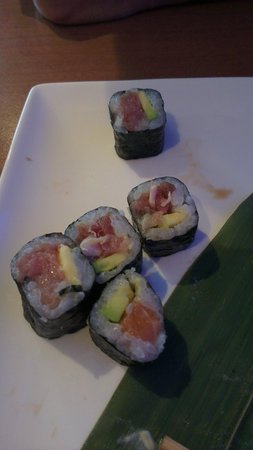
The height and width of the screenshot is (450, 253). What are the coordinates of `serving dish` in the screenshot? It's located at (53, 106).